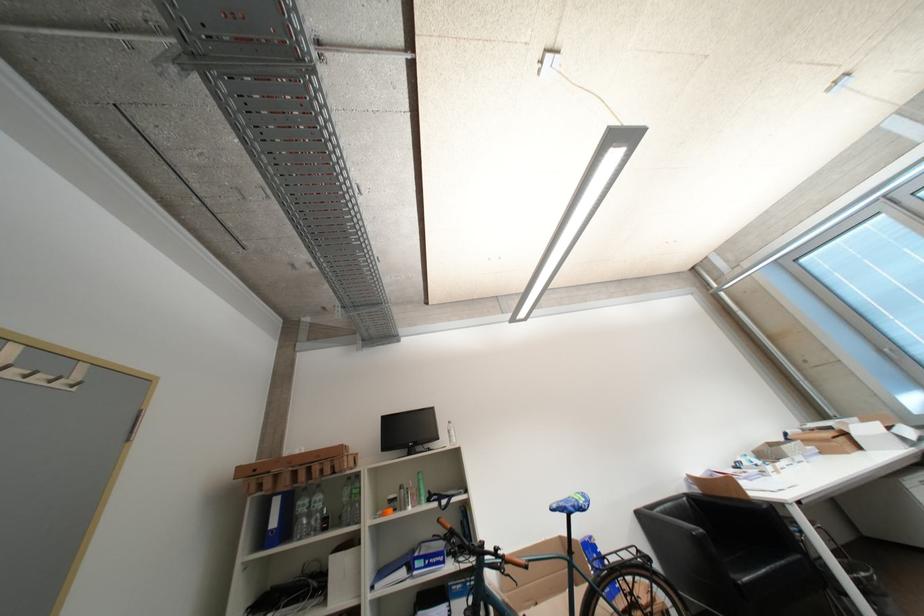
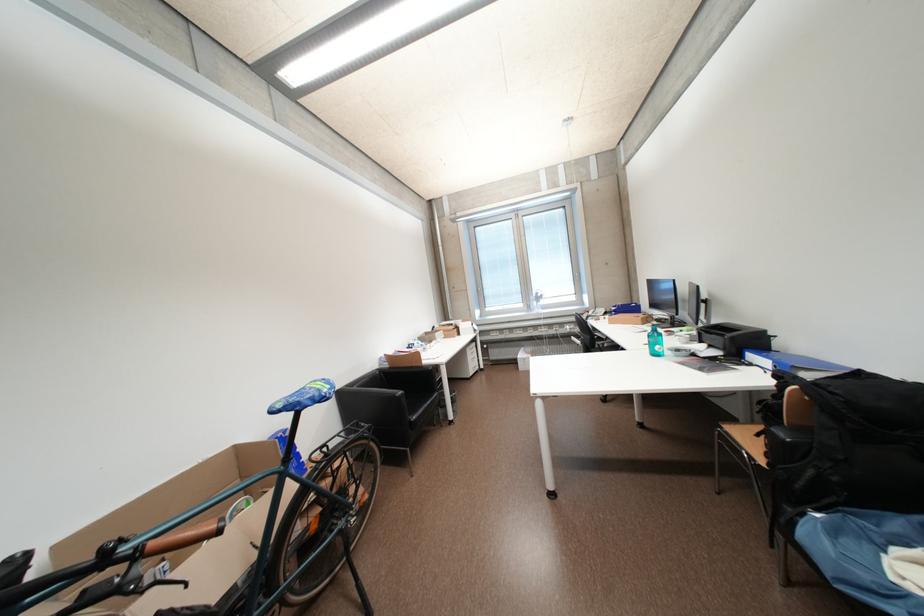
Where in the second image is the point corresponding to pixel 743 498 from the first image?

(421, 367)